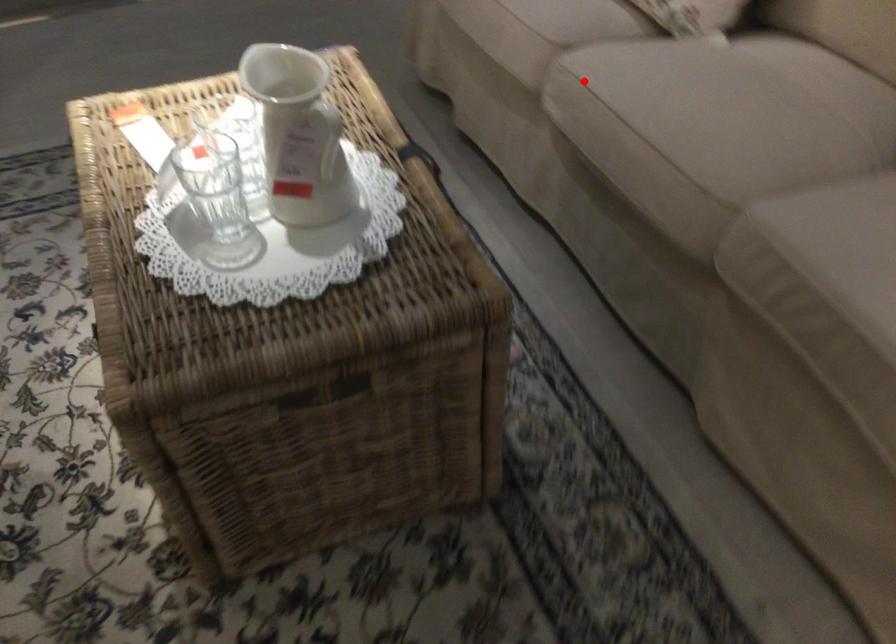
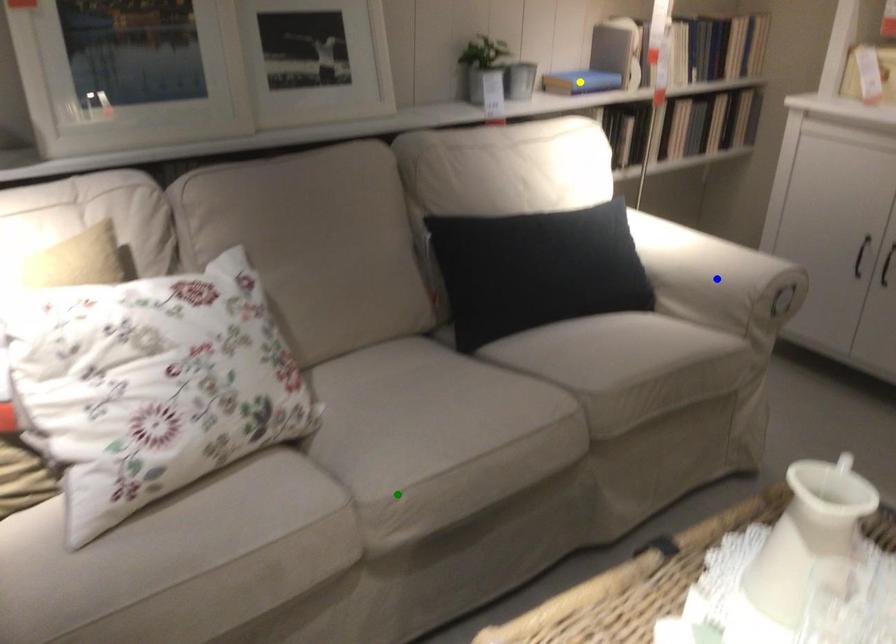
Question: I am providing you with two images of the same scene from different viewpoints. A red point is marked on the first image. You are given multiple points on the second image. Which point in image 2 is actually the same real-world point as the red point in image 1?

Choices:
 (A) green point
 (B) yellow point
 (C) blue point

Answer: (A)